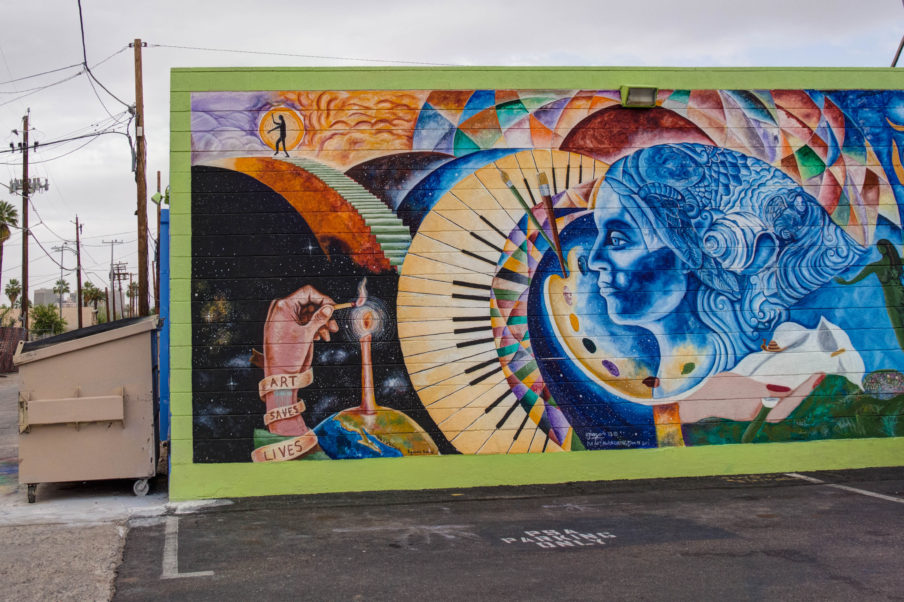
This screenshot has width=904, height=602. I want to click on candle in mural, so tap(359, 326).